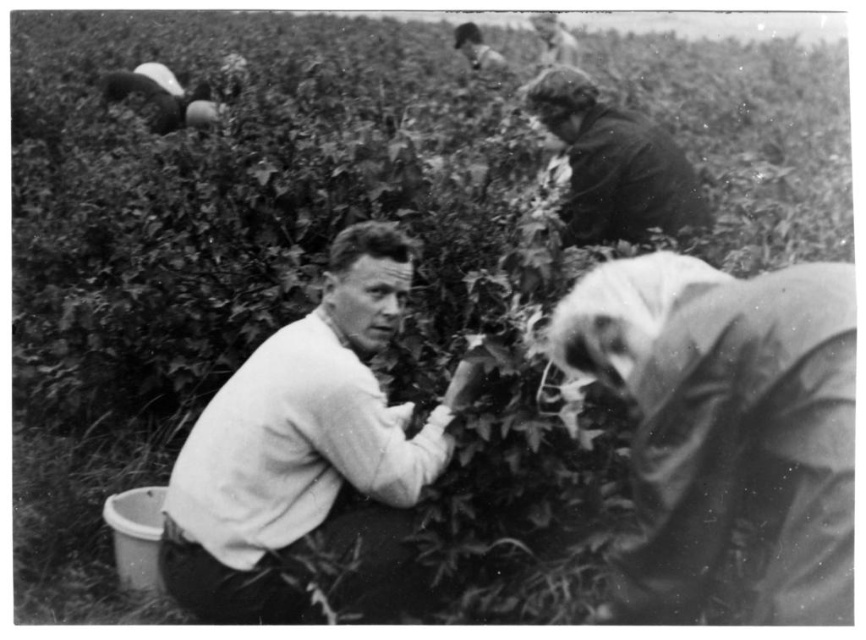
Which is more to the right, white matte shirt at center or smooth skin face at upper center?

From the viewer's perspective, smooth skin face at upper center appears more on the right side.

Is point (294, 440) more distant than point (457, 42)?

No.

Locate an element on the screen. The height and width of the screenshot is (640, 866). white matte shirt at center is located at coordinates (305, 452).

Is dark gray fabric at lower right shorter than dark brown fabric at upper right?

No, dark gray fabric at lower right is not shorter than dark brown fabric at upper right.

Is dark gray fabric at lower right positioned before dark brown fabric at upper right?

Yes, dark gray fabric at lower right is in front of dark brown fabric at upper right.

Where is `dark gray fabric at lower right`? dark gray fabric at lower right is located at coordinates (727, 435).

Identify the location of dark gray fabric at lower right. (727, 435).

Between point (671, 208) and point (473, 54), which one is positioned behind?

Point (473, 54)

Is dark brown fabric at upper right bigger than smooth skin face at upper center?

Incorrect, dark brown fabric at upper right is not larger than smooth skin face at upper center.

Where is `dark brown fabric at upper right`? This screenshot has height=640, width=866. dark brown fabric at upper right is located at coordinates (614, 164).